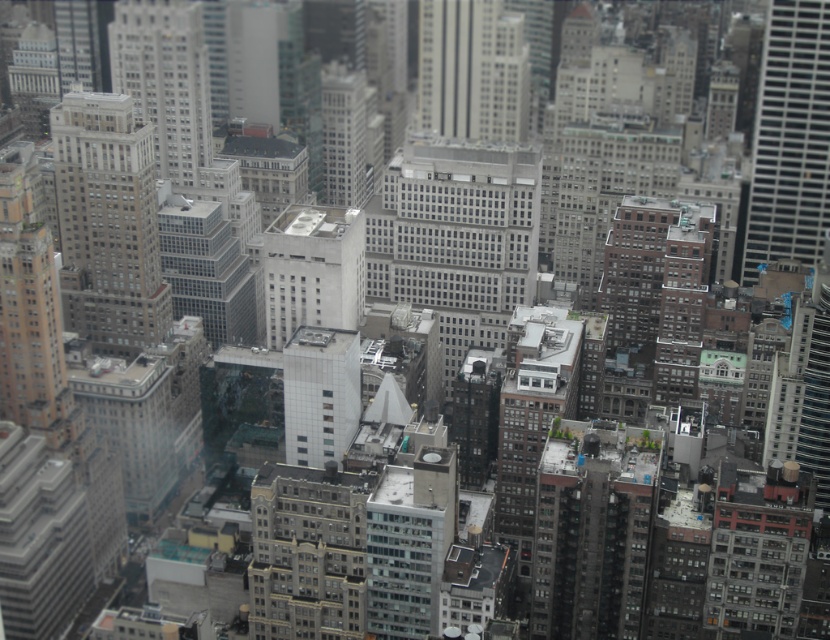
Measure the distance between gray concrete building at center and brown brick building at center.

The distance of gray concrete building at center from brown brick building at center is 89.70 meters.

Is gray concrete building at center thinner than brown brick building at center?

No.

Is point (469, 188) closer to viewer compared to point (325, 570)?

Yes, it is.

Identify the location of gray concrete building at center. This screenshot has width=830, height=640. (456, 237).

Which is below, smooth gray skyscraper at center or gray concrete skyscraper at upper center?

Positioned lower is gray concrete skyscraper at upper center.

Which of these two, smooth gray skyscraper at center or gray concrete skyscraper at upper center, stands taller?

With more height is gray concrete skyscraper at upper center.

Between point (453, 116) and point (184, 138), which one is positioned behind?

Positioned behind is point (184, 138).

Where is `smooth gray skyscraper at center`? The height and width of the screenshot is (640, 830). smooth gray skyscraper at center is located at coordinates (472, 68).

Does brown brick building at center appear on the right side of gray concrete skyscraper at upper center?

Yes, brown brick building at center is to the right of gray concrete skyscraper at upper center.

Who is positioned more to the right, brown brick building at center or gray concrete skyscraper at upper center?

From the viewer's perspective, brown brick building at center appears more on the right side.

Does point (328, 604) lie in front of point (145, 8)?

Yes, point (328, 604) is in front of point (145, 8).

Image resolution: width=830 pixels, height=640 pixels. What are the coordinates of `brown brick building at center` in the screenshot? It's located at (306, 552).